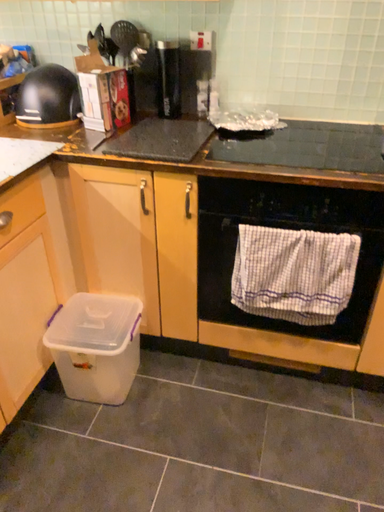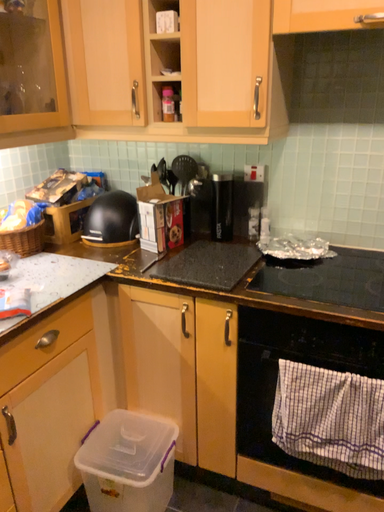
Question: How did the camera likely rotate when shooting the video?

Choices:
 (A) rotated right
 (B) rotated left

Answer: (B)